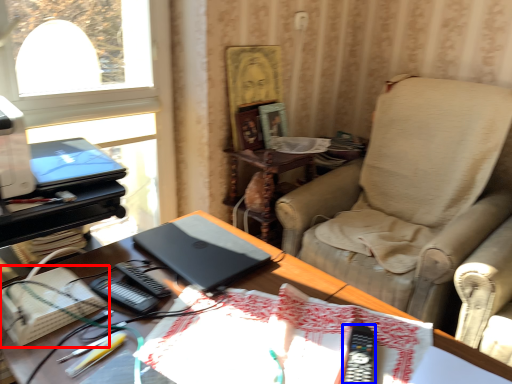
Question: Which of the following is the farthest to the observer, paperback book (highlighted by a red box) or equipment (highlighted by a blue box)?

Choices:
 (A) paperback book
 (B) equipment

Answer: (A)